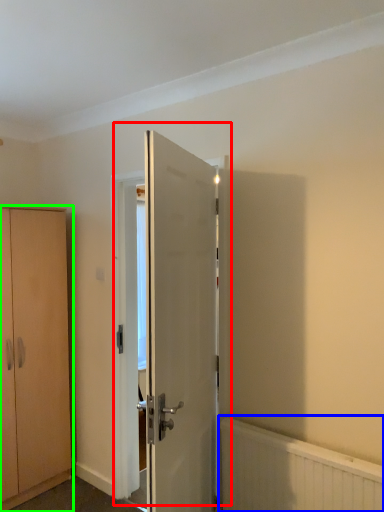
Question: Which is nearer to the door (highlighted by a red box)? radiator (highlighted by a blue box) or cabinetry (highlighted by a green box).

Choices:
 (A) radiator
 (B) cabinetry

Answer: (A)